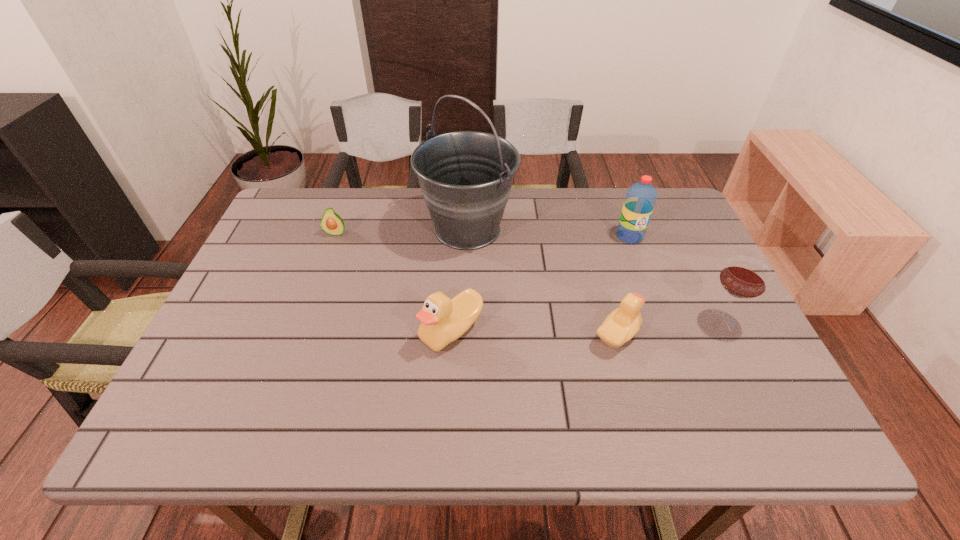
Find the location of a particular element. the taller duck is located at coordinates (443, 320).

Where is `the fourth tallest object`? The image size is (960, 540). the fourth tallest object is located at coordinates (443, 320).

Where is `the third object from right to left`? The image size is (960, 540). the third object from right to left is located at coordinates (621, 325).

Find the location of a particular element. the right duck is located at coordinates click(x=621, y=325).

Locate an element on the screen. The width and height of the screenshot is (960, 540). bucket is located at coordinates (466, 177).

The image size is (960, 540). Find the location of `the second object from right to left`. the second object from right to left is located at coordinates (641, 197).

Where is `water bottle`? water bottle is located at coordinates (641, 197).

The image size is (960, 540). What are the coordinates of `avocado` in the screenshot? It's located at (331, 223).

Where is `the third tallest object`? the third tallest object is located at coordinates (743, 277).

The height and width of the screenshot is (540, 960). In order to click on wineglass in this screenshot , I will do `click(743, 277)`.